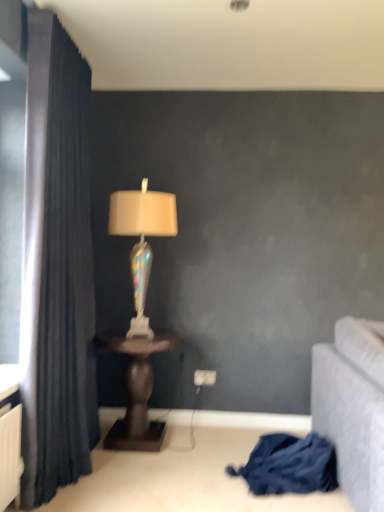
Question: Is brown wooden table at center positioned with its back to dark blue fabric curtain at left?

Choices:
 (A) yes
 (B) no

Answer: (B)

Question: From a real-world perspective, is brown wooden table at center on top of dark blue fabric curtain at left?

Choices:
 (A) no
 (B) yes

Answer: (A)

Question: Is brown wooden table at center not near dark blue fabric curtain at left?

Choices:
 (A) no
 (B) yes

Answer: (A)

Question: Can you confirm if brown wooden table at center is smaller than dark blue fabric curtain at left?

Choices:
 (A) yes
 (B) no

Answer: (A)

Question: Can you see brown wooden table at center touching dark blue fabric curtain at left?

Choices:
 (A) yes
 (B) no

Answer: (B)

Question: From the image's perspective, is brown wooden table at center located beneath dark blue fabric curtain at left?

Choices:
 (A) yes
 (B) no

Answer: (A)

Question: Is blue fabric at lower right to the left of brown wooden table at center from the viewer's perspective?

Choices:
 (A) yes
 (B) no

Answer: (B)

Question: From a real-world perspective, is blue fabric at lower right physically below brown wooden table at center?

Choices:
 (A) yes
 (B) no

Answer: (A)

Question: Is blue fabric at lower right positioned beyond the bounds of brown wooden table at center?

Choices:
 (A) no
 (B) yes

Answer: (B)

Question: From the image's perspective, does blue fabric at lower right appear lower than brown wooden table at center?

Choices:
 (A) no
 (B) yes

Answer: (B)

Question: Is blue fabric at lower right looking in the opposite direction of brown wooden table at center?

Choices:
 (A) yes
 (B) no

Answer: (B)

Question: From the image's perspective, is blue fabric at lower right over brown wooden table at center?

Choices:
 (A) no
 (B) yes

Answer: (A)

Question: Can you confirm if brown wooden table at center is bigger than blue fabric at lower right?

Choices:
 (A) no
 (B) yes

Answer: (B)